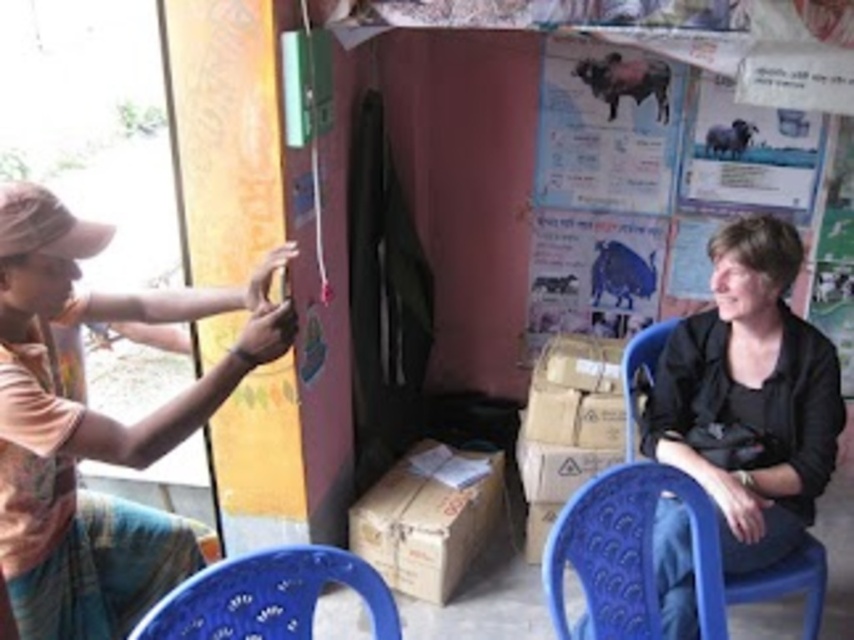
You are standing in the room and want to reach the black matte jacket at lower right without moving the blue plastic chair at lower center. Which direction should you move towards?

The black matte jacket at lower right is positioned on the right side of blue plastic chair at lower center, so you should move towards the right side of the blue plastic chair at lower center to reach the black matte jacket at lower right without moving it.